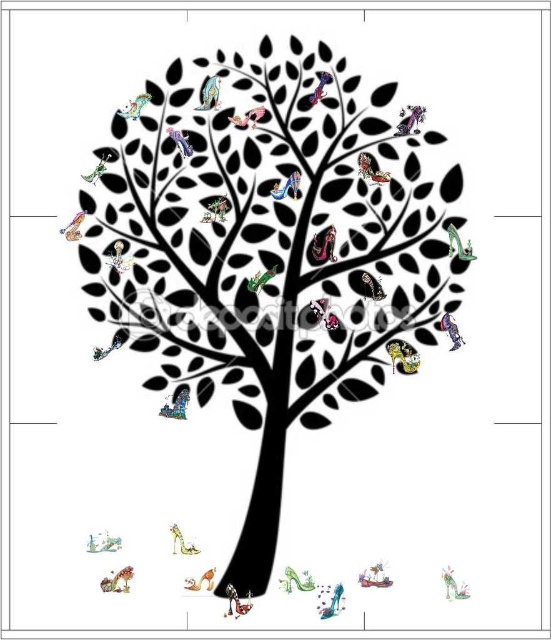
You are standing in front of the tree and want to pick up the two points mentioned. Which point, point (x=460, y=588) or point (x=190, y=154), is closer to you?

Point (x=460, y=588) is closer to the viewer than point (x=190, y=154).

Looking at this image, you are an artist planning to paint a scene similar to the one described. You want to place a metallic blue bird at upper left in your painting. Where should you position it relative to the black matte tree at center?

The metallic blue bird at upper left should be placed to the left of the black matte tree at center since the tree is positioned to the right of the bird.